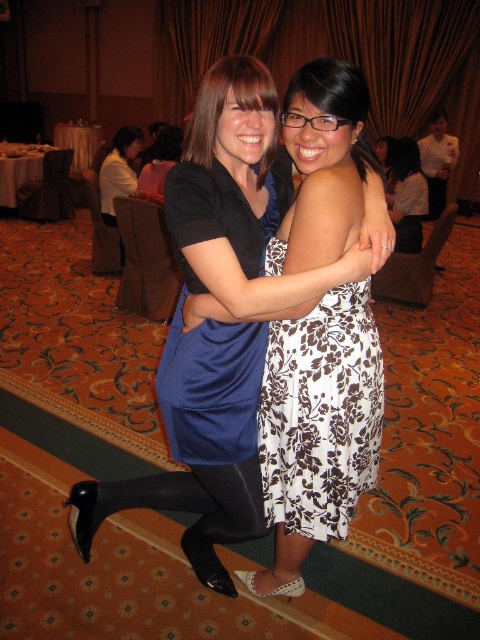
The height and width of the screenshot is (640, 480). I want to click on brown floral fabric dress at center, so click(321, 413).

Can you confirm if brown floral fabric dress at center is taller than matte black dress at upper left?

No.

Which is behind, point (276, 486) or point (140, 145)?

Positioned behind is point (140, 145).

This screenshot has height=640, width=480. I want to click on brown floral fabric dress at center, so click(321, 413).

Is matte blue dress at center above white satin dress at upper center?

No.

Is matte blue dress at center taller than white satin dress at upper center?

Incorrect, matte blue dress at center's height is not larger of white satin dress at upper center's.

This screenshot has width=480, height=640. What are the coordinates of `matte blue dress at center` in the screenshot? It's located at (213, 321).

Does brown floral fabric dress at center appear on the right side of floral dress at center?

Incorrect, brown floral fabric dress at center is not on the right side of floral dress at center.

Is brown floral fabric dress at center smaller than floral dress at center?

Indeed, brown floral fabric dress at center has a smaller size compared to floral dress at center.

Does point (317, 333) lie behind point (407, 224)?

No, it is in front of (407, 224).

Identify the location of brown floral fabric dress at center. (321, 413).